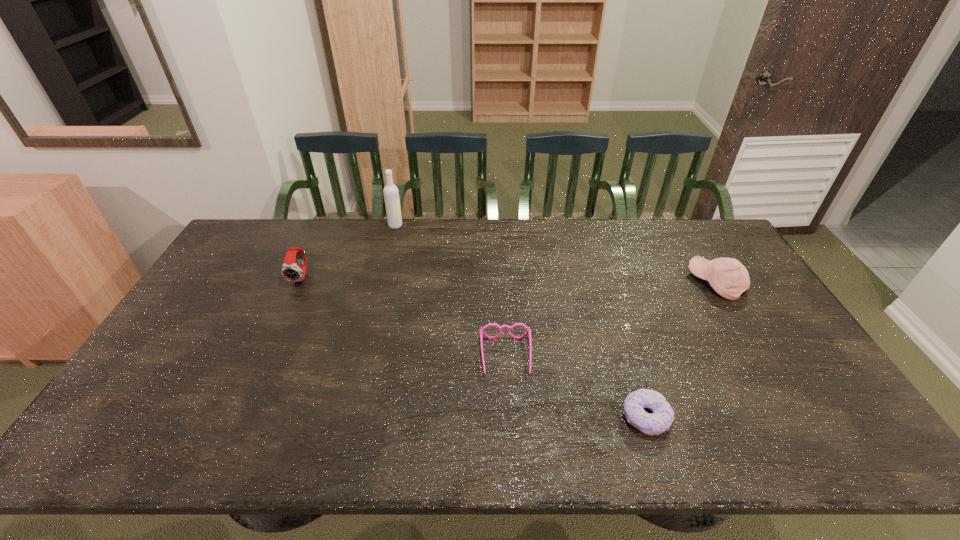
Identify the location of free space at the far left corner of the desktop. (265, 233).

Locate an element on the screen. Image resolution: width=960 pixels, height=540 pixels. blank space at the far right corner is located at coordinates (708, 242).

In order to click on free space between the fourth farthest object and the baseball cap in this screenshot , I will do tap(611, 320).

Identify the location of free spot between the leftmost object and the vodka. This screenshot has width=960, height=540. (348, 251).

Find the location of a particular element. unoccupied area between the vodka and the leftmost object is located at coordinates (348, 251).

I want to click on blank region between the fourth object from left to right and the leftmost object, so coord(473,347).

You are a GUI agent. You are given a task and a screenshot of the screen. Output one action in this format:
    pyautogui.click(x=<x>, y=<y>)
    Task: Click on the free space between the third object from left to right and the fourth object from right to left
    This screenshot has width=960, height=540.
    Given the screenshot: What is the action you would take?
    pyautogui.click(x=451, y=291)

Identify the location of vacant space that's between the fourth object from right to left and the fourth farthest object. This screenshot has height=540, width=960. (451, 291).

Identify the location of free spot between the third object from right to left and the leftmost object. (404, 316).

Find the location of `free space between the baseball cap and the third object from right to left`. free space between the baseball cap and the third object from right to left is located at coordinates (611, 320).